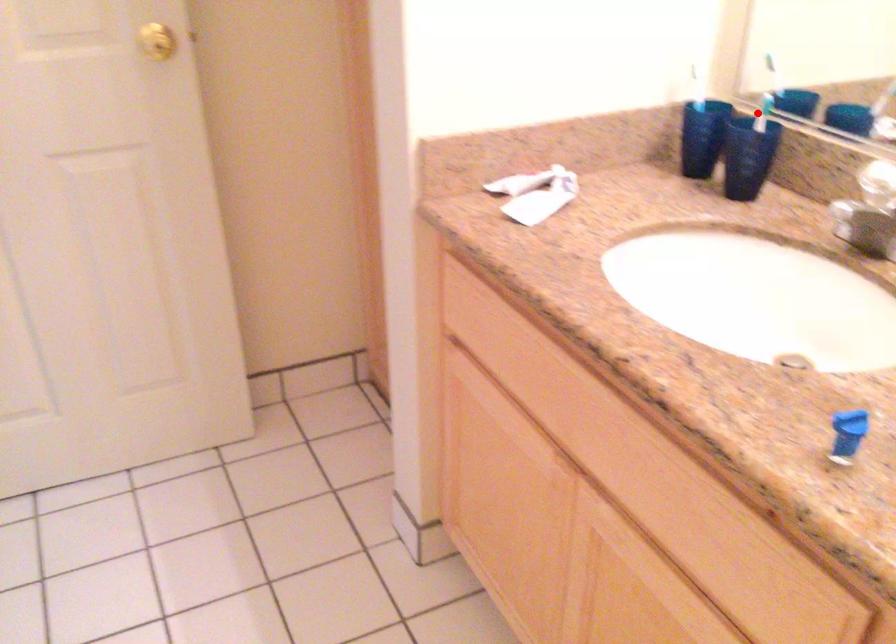
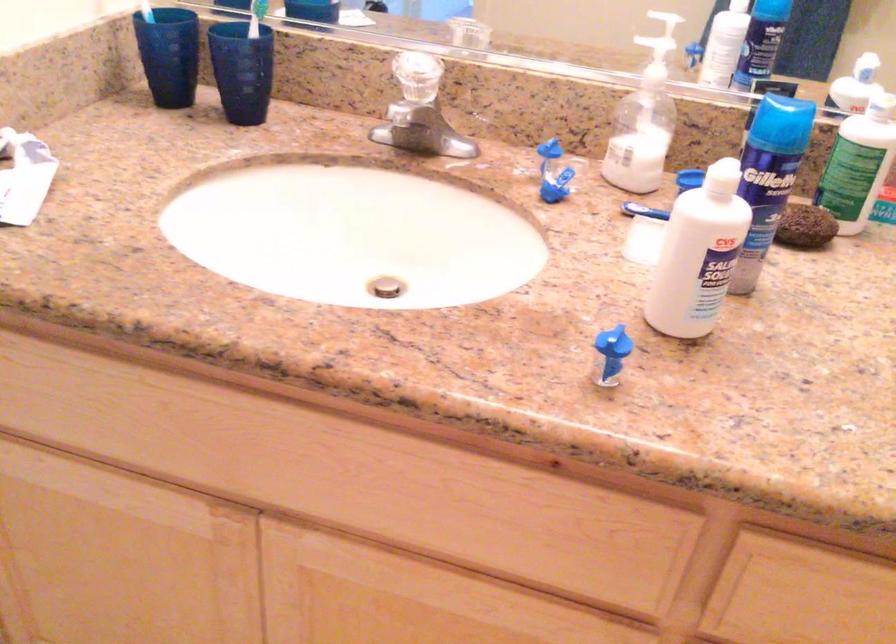
Question: A red point is marked in image1. In image2, is the corresponding 3D point closer to the camera or farther? Reply with the corresponding letter.

Choices:
 (A) The corresponding 3D point is closer.
 (B) The corresponding 3D point is farther.

Answer: (A)